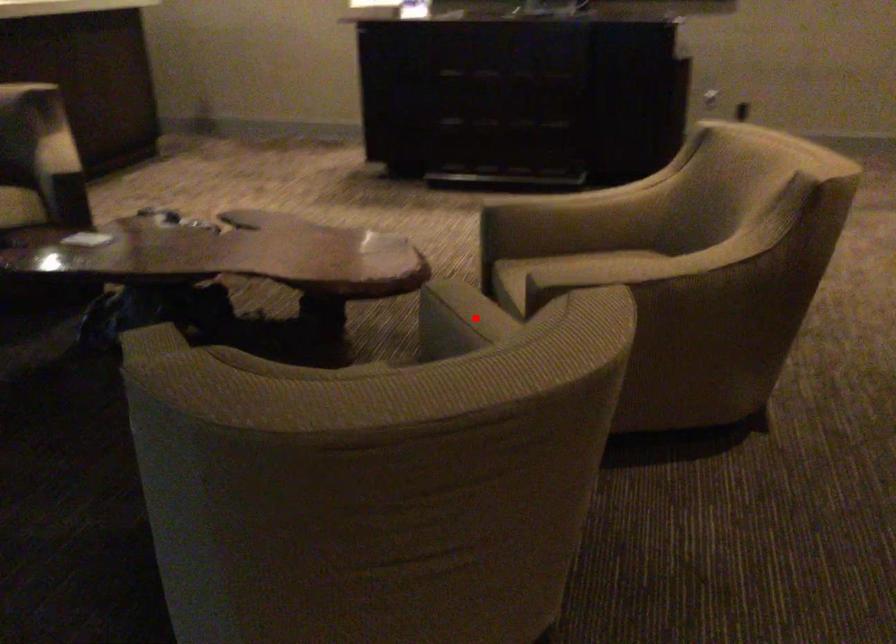
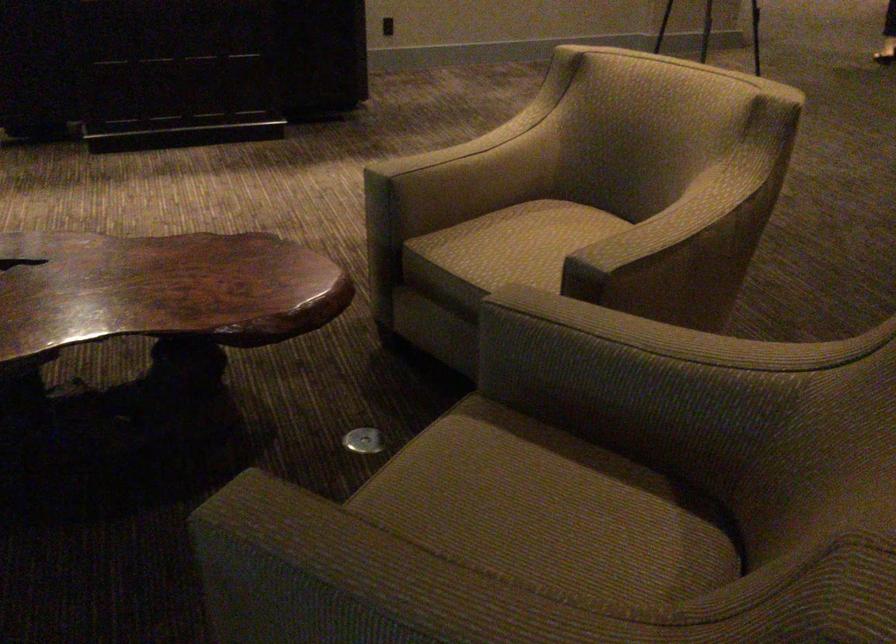
Question: A red point is marked in image1. In image2, is the corresponding 3D point closer to the camera or farther? Reply with the corresponding letter.

Choices:
 (A) The corresponding 3D point is closer.
 (B) The corresponding 3D point is farther.

Answer: (A)